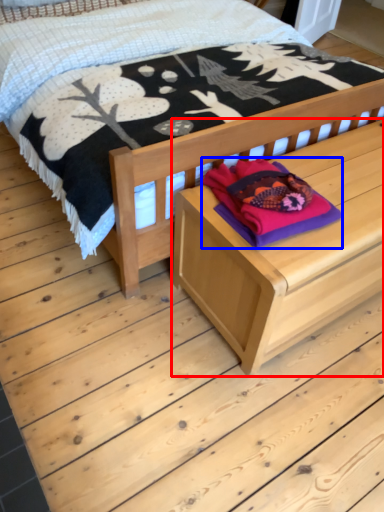
Question: Among these objects, which one is farthest to the camera, table (highlighted by a red box) or clothing (highlighted by a blue box)?

Choices:
 (A) table
 (B) clothing

Answer: (B)